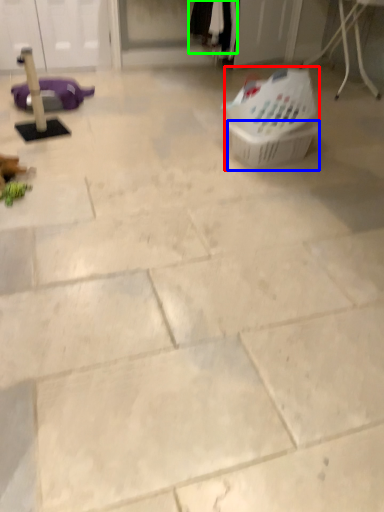
Question: Estimate the real-world distances between objects in this image. Which object is closer to basket (highlighted by a red box), basket (highlighted by a blue box) or clothing (highlighted by a green box)?

Choices:
 (A) basket
 (B) clothing

Answer: (A)